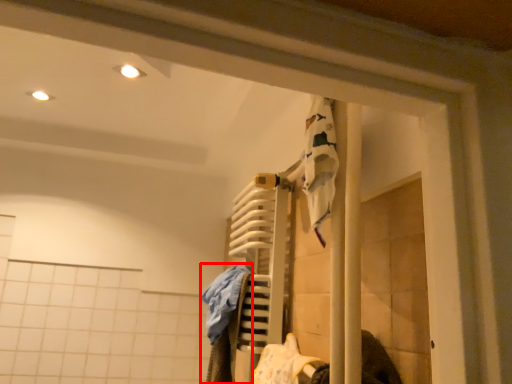
Question: Where is clothing (annotated by the red box) located in relation to clothing in the image?

Choices:
 (A) left
 (B) right

Answer: (A)